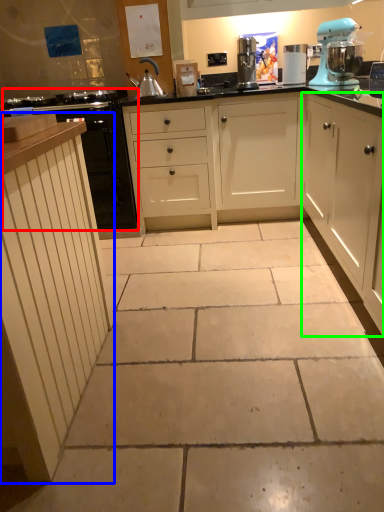
Question: Considering the real-world distances, which object is closest to cabinetry (highlighted by a red box)? cabinetry (highlighted by a blue box) or cabinetry (highlighted by a green box).

Choices:
 (A) cabinetry
 (B) cabinetry

Answer: (A)